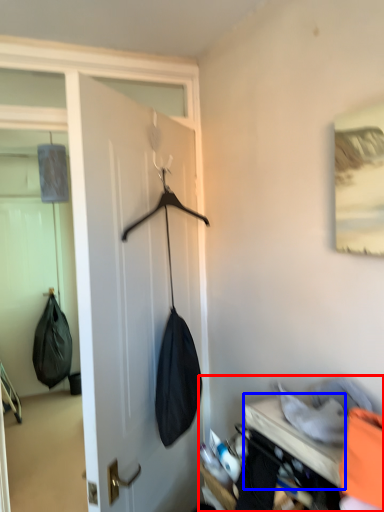
Question: Which object appears farthest to the camera in this image, closet (highlighted by a red box) or furniture (highlighted by a blue box)?

Choices:
 (A) closet
 (B) furniture

Answer: (B)